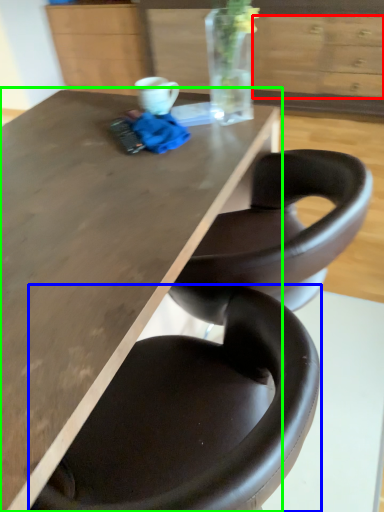
Question: Considering the real-world distances, which object is closest to drawer (highlighted by a red box)? chair (highlighted by a blue box) or table (highlighted by a green box).

Choices:
 (A) chair
 (B) table

Answer: (B)